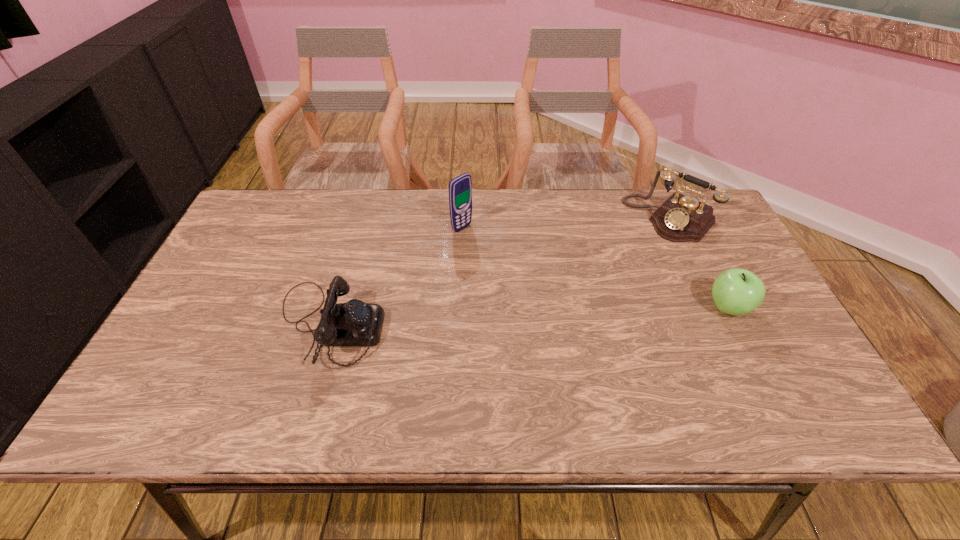
Find the location of a particular element. The height and width of the screenshot is (540, 960). blank space at the far edge of the desktop is located at coordinates (483, 217).

In order to click on free space at the near edge in this screenshot , I will do `click(578, 355)`.

Locate an element on the screen. vacant space at the left edge is located at coordinates (183, 340).

Find the location of a particular element. The image size is (960, 540). vacant space at the right edge of the desktop is located at coordinates (713, 280).

What are the coordinates of `free space at the far left corner of the desktop` in the screenshot? It's located at (300, 195).

At what (x,y) coordinates should I click in order to perform the action: click on unoccupied area between the right telephone and the nearer telephone. Please return your answer as a coordinate pair (x, y). The height and width of the screenshot is (540, 960). Looking at the image, I should click on (499, 272).

Identify the location of free spot between the apple and the left telephone. (528, 316).

Where is `free space between the taller telephone and the apple`? Image resolution: width=960 pixels, height=540 pixels. free space between the taller telephone and the apple is located at coordinates (699, 263).

You are a GUI agent. You are given a task and a screenshot of the screen. Output one action in this format:
    pyautogui.click(x=<x>, y=<y>)
    Task: Click on the unoccupied position between the apple and the second object from left to right
    The width and height of the screenshot is (960, 540).
    Given the screenshot: What is the action you would take?
    pyautogui.click(x=595, y=268)

You are a GUI agent. You are given a task and a screenshot of the screen. Output one action in this format:
    pyautogui.click(x=<x>, y=<y>)
    Task: Click on the vacant region between the farther telephone and the left telephone
    This screenshot has height=540, width=960.
    Given the screenshot: What is the action you would take?
    pyautogui.click(x=499, y=272)